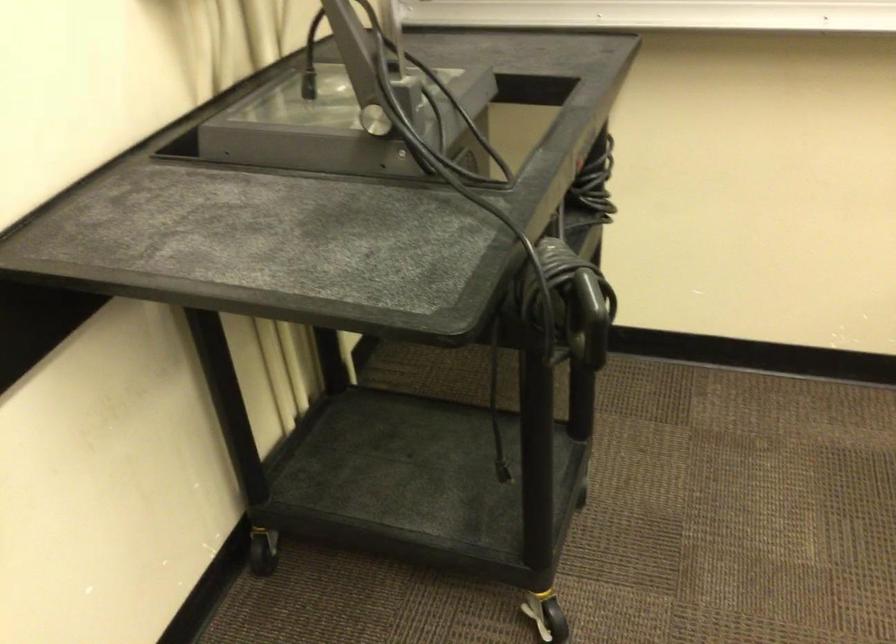
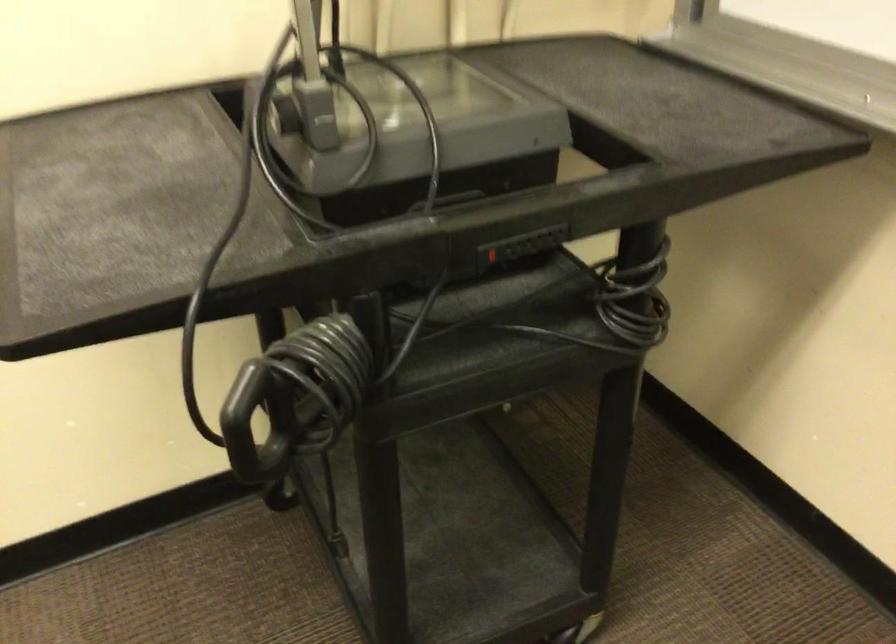
Question: The camera is either moving clockwise (left) or counter-clockwise (right) around the object. The first image is from the beginning of the video and the second image is from the end. Is the camera moving left or right when shooting the video?

Choices:
 (A) Left
 (B) Right

Answer: (B)